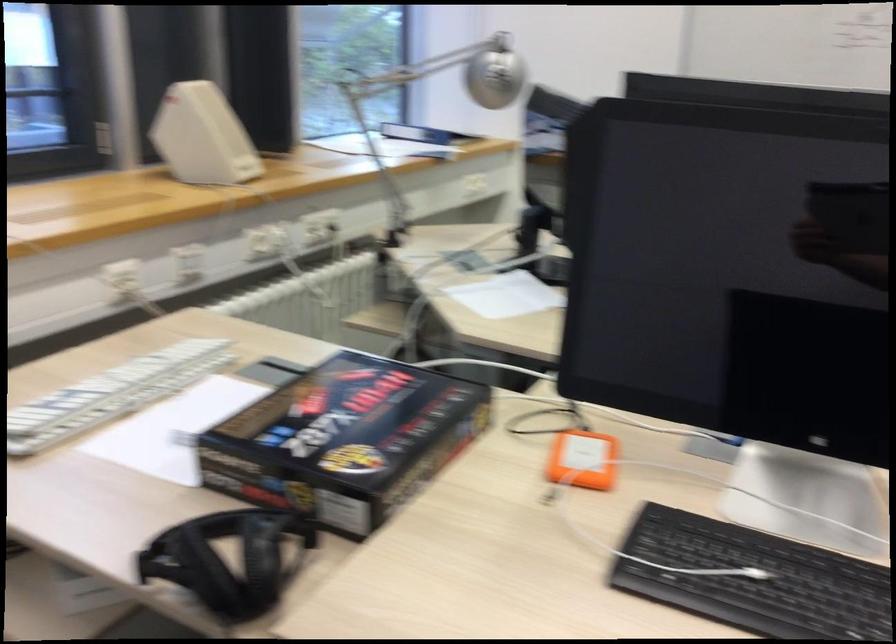
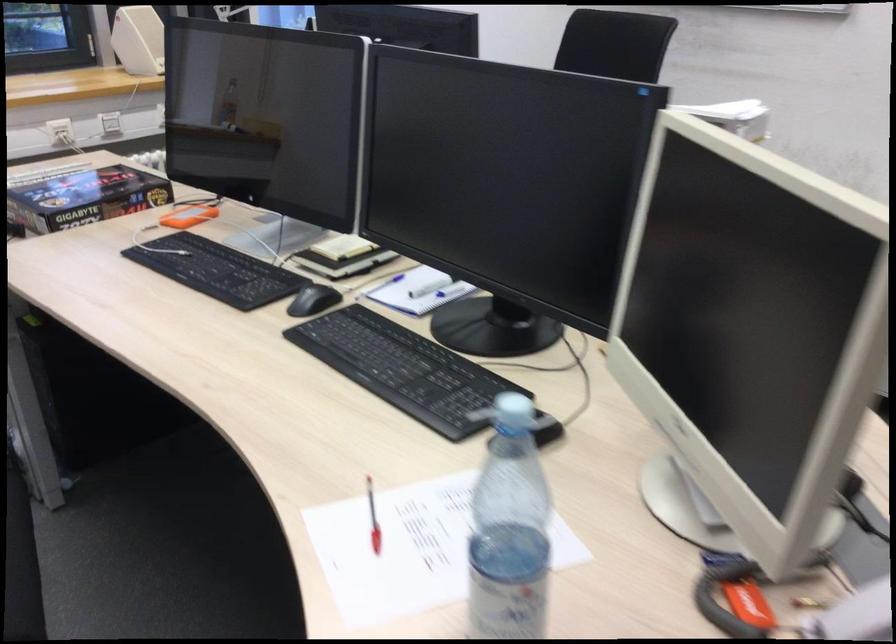
Where in the second image is the point corresponding to point (572, 449) from the first image?

(188, 216)